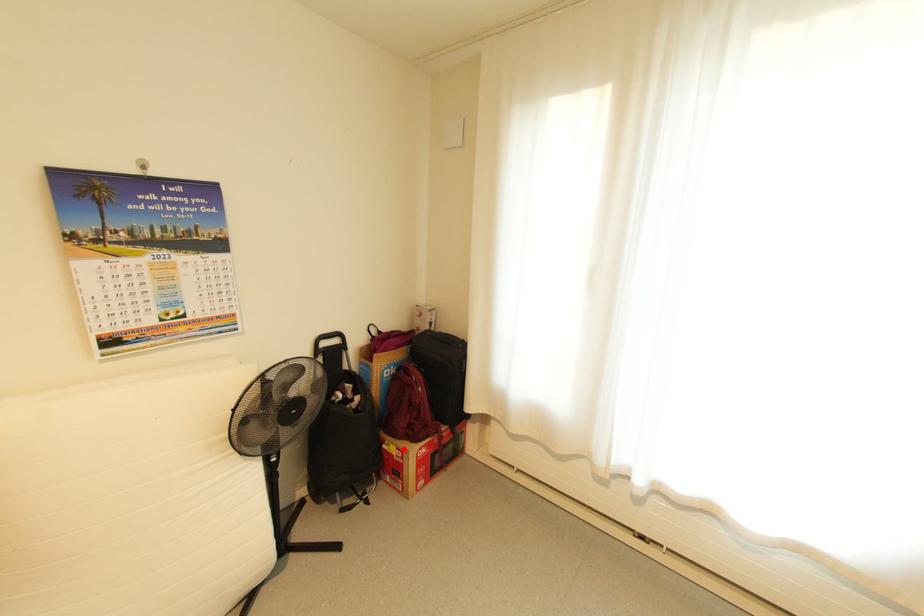
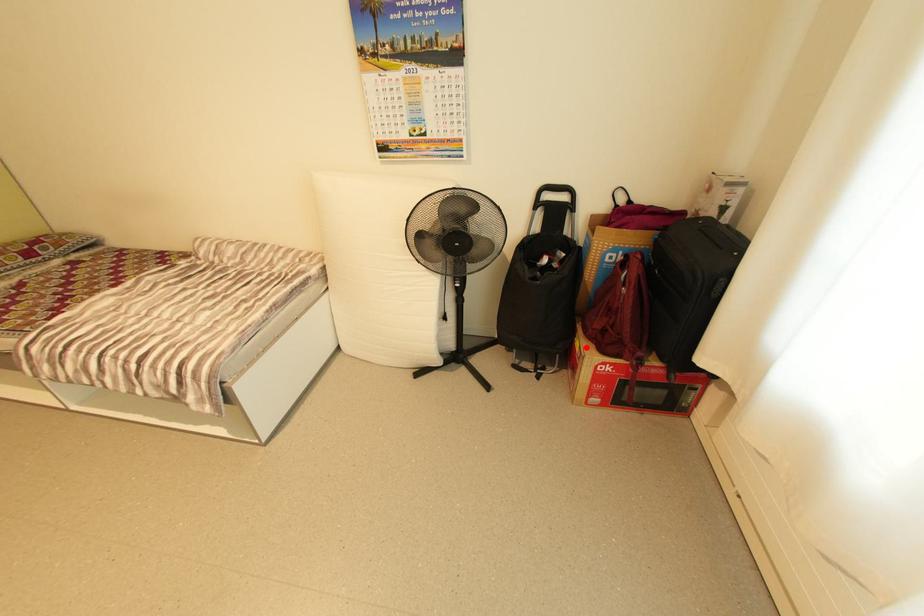
I am providing you with two images of the same scene from different viewpoints. A red point is marked on the first image and another point is marked on the second image. Is the marked point in image1 the same physical position as the marked point in image2?

Yes